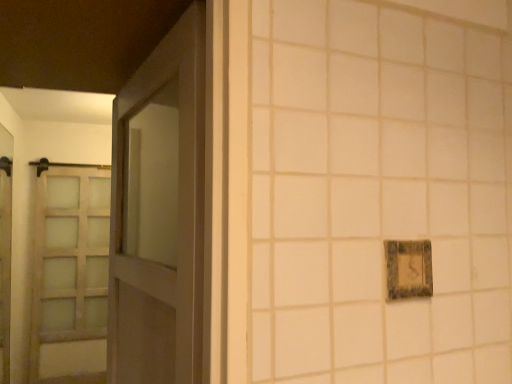
Question: Can you confirm if matte glass elevator at left is shorter than satin wood barn door at left?

Choices:
 (A) yes
 (B) no

Answer: (A)

Question: Is the position of matte glass elevator at left more distant than that of satin wood barn door at left?

Choices:
 (A) no
 (B) yes

Answer: (A)

Question: From the image's perspective, is matte glass elevator at left above satin wood barn door at left?

Choices:
 (A) no
 (B) yes

Answer: (B)

Question: Is matte glass elevator at left aimed at satin wood barn door at left?

Choices:
 (A) no
 (B) yes

Answer: (A)

Question: Is matte glass elevator at left at the right side of satin wood barn door at left?

Choices:
 (A) no
 (B) yes

Answer: (A)

Question: Considering their positions, is rustic stone picture frame at right located in front of or behind matte glass elevator at left?

Choices:
 (A) behind
 (B) front

Answer: (B)

Question: Is rustic stone picture frame at right bigger or smaller than matte glass elevator at left?

Choices:
 (A) big
 (B) small

Answer: (B)

Question: Does point (391, 289) appear closer or farther from the camera than point (5, 321)?

Choices:
 (A) farther
 (B) closer

Answer: (B)

Question: In the image, is rustic stone picture frame at right on the left side or the right side of matte glass elevator at left?

Choices:
 (A) left
 (B) right

Answer: (B)

Question: From the image's perspective, is rustic stone picture frame at right above or below matte wood door at left?

Choices:
 (A) below
 (B) above

Answer: (B)

Question: Is rustic stone picture frame at right inside or outside of matte wood door at left?

Choices:
 (A) outside
 (B) inside

Answer: (A)

Question: In the image, is rustic stone picture frame at right positioned in front of or behind matte wood door at left?

Choices:
 (A) behind
 (B) front

Answer: (A)

Question: From a real-world perspective, is rustic stone picture frame at right above or below matte wood door at left?

Choices:
 (A) below
 (B) above

Answer: (A)

Question: Is matte glass elevator at left situated inside rustic stone picture frame at right or outside?

Choices:
 (A) outside
 (B) inside

Answer: (A)

Question: From the image's perspective, is matte glass elevator at left located above or below rustic stone picture frame at right?

Choices:
 (A) below
 (B) above

Answer: (A)